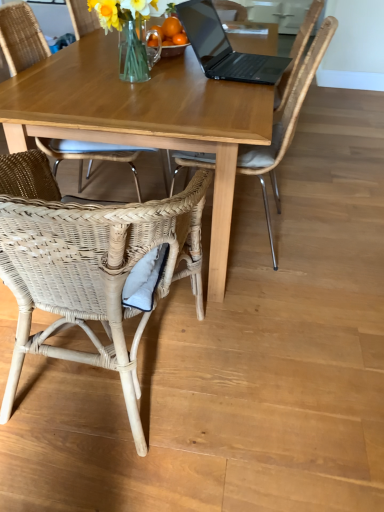
Question: Is translucent glass vase at upper center in front of or behind woven rattan chair at lower left, which is the 2th chair in left-to-right order, in the image?

Choices:
 (A) behind
 (B) front

Answer: (A)

Question: Considering the positions of translucent glass vase at upper center and woven rattan chair at lower left, arranged as the second chair when viewed from the right, in the image, is translucent glass vase at upper center wider or thinner than woven rattan chair at lower left, arranged as the second chair when viewed from the right,?

Choices:
 (A) wide
 (B) thin

Answer: (B)

Question: Which is farther from the wooden table at center?

Choices:
 (A) black matte laptop at upper center
 (B) woven rattan chair at lower left, arranged as the second chair when viewed from the right
 (C) translucent glass vase at upper center
 (D) woven wicker chair at lower left, the third chair positioned from the right
 (E) woven rattan chair at upper center, the first chair when ordered from right to left

Answer: (A)

Question: Which object is the farthest from the woven wicker chair at lower left, the third chair positioned from the right?

Choices:
 (A) wooden table at center
 (B) woven rattan chair at upper center, the first chair when ordered from right to left
 (C) woven rattan chair at lower left, arranged as the second chair when viewed from the right
 (D) black matte laptop at upper center
 (E) translucent glass vase at upper center

Answer: (D)